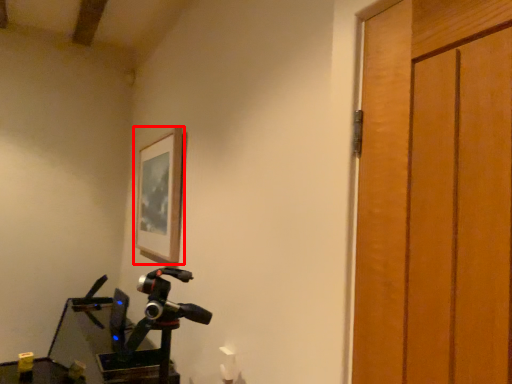
Question: From the image's perspective, considering the relative positions of picture frame (annotated by the red box) and workbench in the image provided, where is picture frame (annotated by the red box) located with respect to the staircase?

Choices:
 (A) below
 (B) above

Answer: (B)